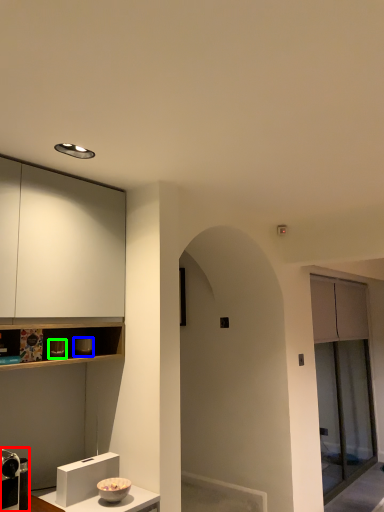
Question: Estimate the real-world distances between objects in this image. Which object is closer to appliance (highlighted by a red box), appliance (highlighted by a blue box) or appliance (highlighted by a green box)?

Choices:
 (A) appliance
 (B) appliance

Answer: (B)